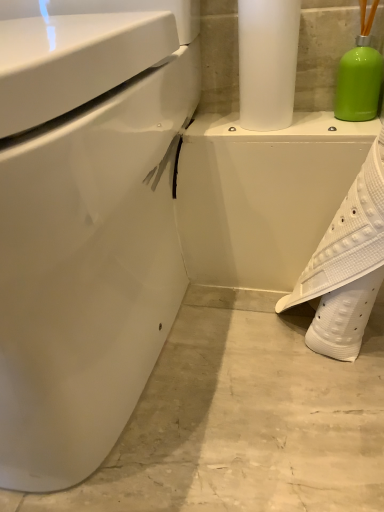
Question: Is white textured shoe at lower right spatially inside white glossy porcelain at center, or outside of it?

Choices:
 (A) inside
 (B) outside

Answer: (B)

Question: Considering the positions of point (334, 303) and point (296, 167), is point (334, 303) closer or farther from the camera than point (296, 167)?

Choices:
 (A) farther
 (B) closer

Answer: (B)

Question: Estimate the real-world distances between objects in this image. Which object is farther from the white textured shoe at lower right?

Choices:
 (A) white glossy toilet at left
 (B) white glossy porcelain at center
 (C) satin white paper towel at upper center

Answer: (A)

Question: Which is farther from the white textured shoe at lower right?

Choices:
 (A) satin white paper towel at upper center
 (B) white glossy toilet at left
 (C) white glossy porcelain at center

Answer: (B)